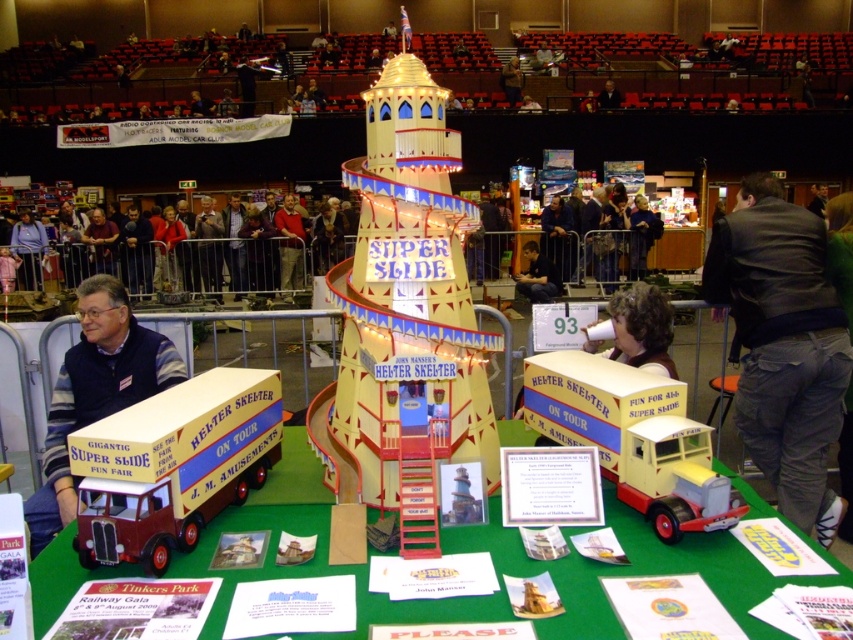
Who is taller, gold metallic helter skelter at center or matte black jacket at center?

With more height is matte black jacket at center.

Can you confirm if gold metallic helter skelter at center is taller than matte black jacket at center?

In fact, gold metallic helter skelter at center may be shorter than matte black jacket at center.

Is point (490, 429) less distant than point (196, 264)?

Yes, point (490, 429) is in front of point (196, 264).

The height and width of the screenshot is (640, 853). I want to click on gold metallic helter skelter at center, so click(x=405, y=316).

Who is taller, black leather jacket at upper right or maroon plastic truck at lower left?

With more height is black leather jacket at upper right.

At what (x,y) coordinates should I click in order to perform the action: click on black leather jacket at upper right. Please return your answer as a coordinate pair (x, y). Image resolution: width=853 pixels, height=640 pixels. Looking at the image, I should click on (782, 346).

Who is more forward, (792, 493) or (105, 448)?

Positioned in front is point (105, 448).

Find the location of `black leather jacket at upper right`. black leather jacket at upper right is located at coordinates (782, 346).

Does dark gray jacket at center have a lesser width compared to matte black shirt at center?

No, dark gray jacket at center is not thinner than matte black shirt at center.

Who is more forward, (x=618, y=256) or (x=517, y=275)?

Point (x=517, y=275)

You are a GUI agent. You are given a task and a screenshot of the screen. Output one action in this format:
    pyautogui.click(x=<x>, y=<y>)
    Task: Click on the dark gray jacket at center
    The image size is (853, 640).
    Given the screenshot: What is the action you would take?
    pyautogui.click(x=614, y=236)